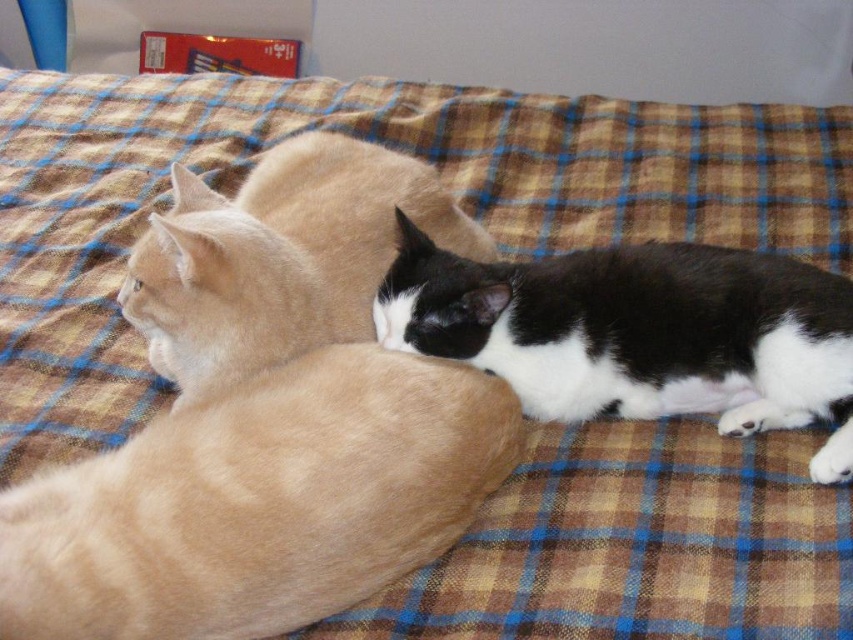
Based on the photo, you are a photographer trying to capture a closeup of the fluffy beige cat at center and the black and white fur cat at center. Since you can only focus on one cat at a time, which cat should you focus on if you want to ensure the other is in the background?

The fluffy beige cat at center is located above the black and white fur cat at center, so focusing on the fluffy beige cat at center will place the black and white fur cat at center in the background.

You are a cat owner who wants to place a small heating pad between the fluffy beige cat at center and the black and white fur cat at center. Which cat will the heating pad be closer to if you place it directly between them?

The heating pad will be closer to the black and white fur cat at center because the fluffy beige cat at center is much taller, meaning the distance from the heating pad to the black and white fur cat at center is shorter.

You are a photographer positioned at the camera. You want to take a photo that includes both the point at coordinates point (0, 509) and point (830, 320). Which point should you focus on first to ensure both are in focus?

You should focus on point (0, 509) first because it is closer to the camera than point (830, 320). This ensures the foreground is sharp, and the background point will also be in focus due to depth of field.